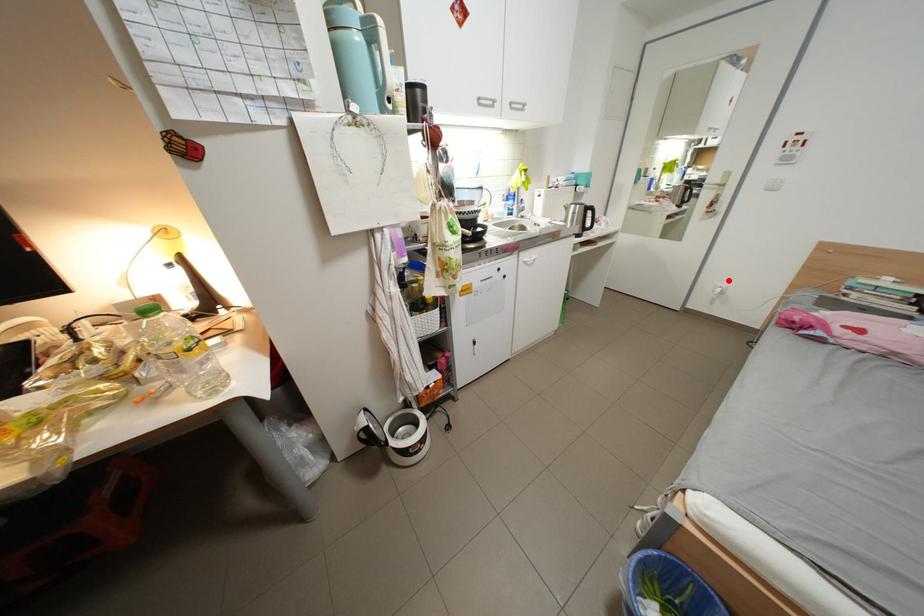
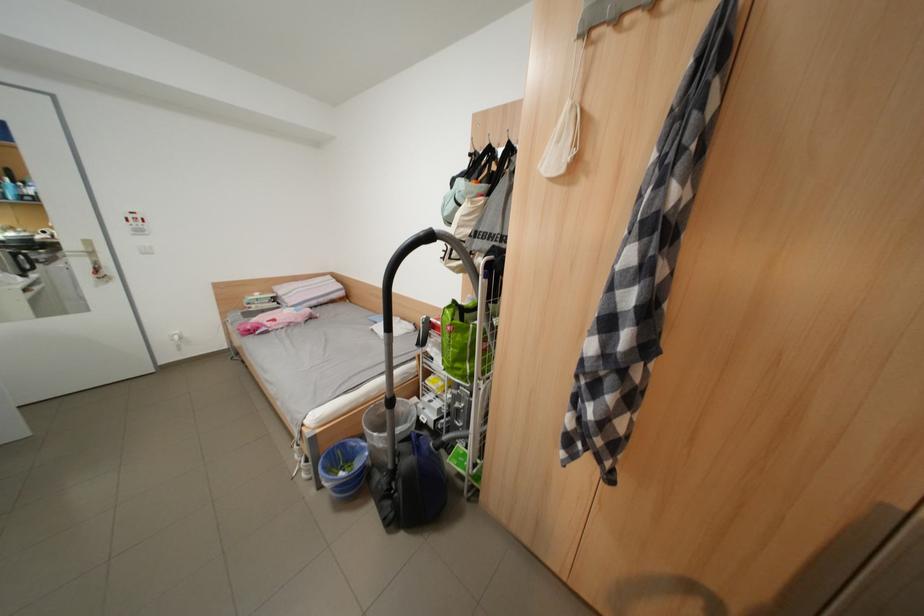
Question: I am providing you with two images of the same scene from different viewpoints. Image1 has a red point marked. In image2, the corresponding 3D location appears at what relative position? Reply with the corresponding letter.

Choices:
 (A) Closer
 (B) Farther

Answer: (A)